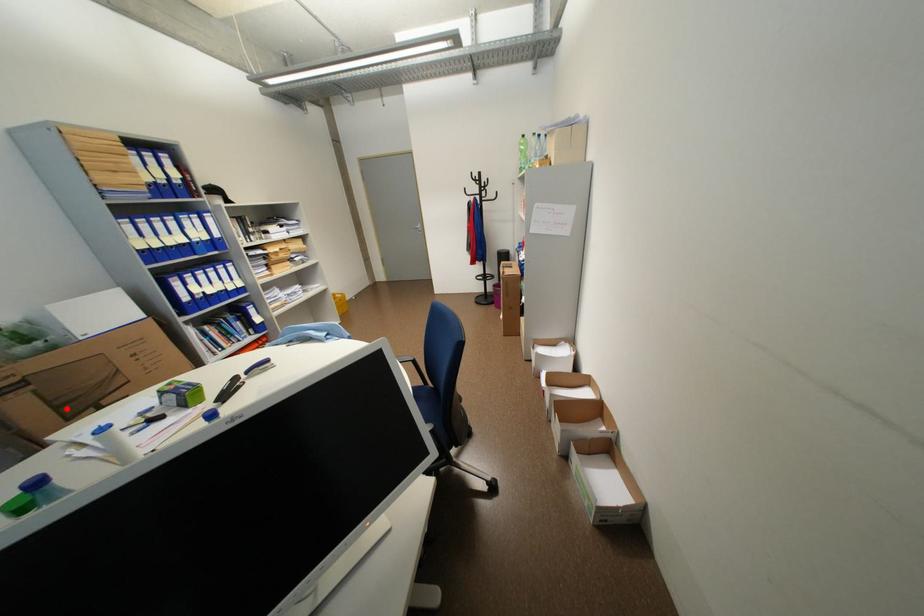
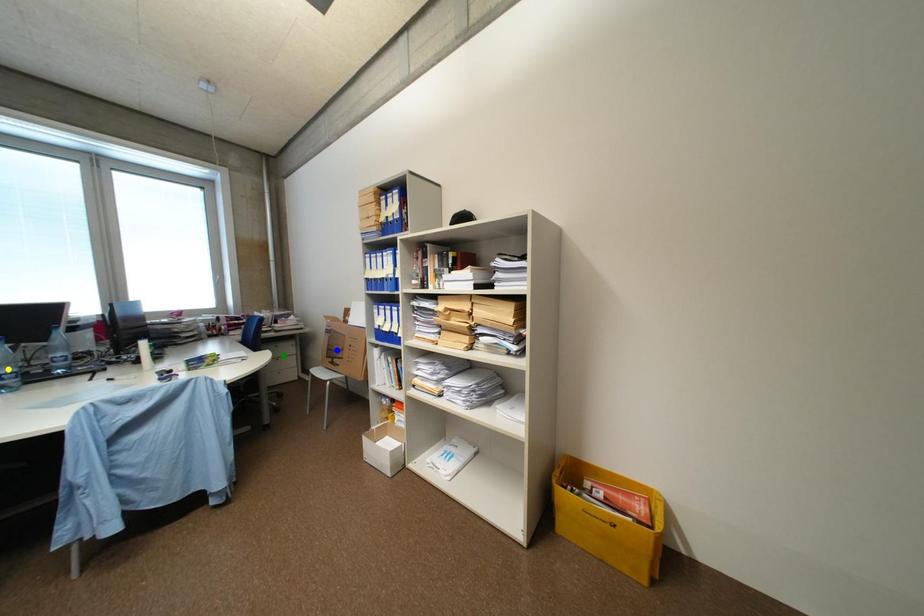
Question: I am providing you with two images of the same scene from different viewpoints. A red point is marked on the first image. You are given multiple points on the second image. Which point in image 2 represents the same 3d spot as the red point in image 1?

Choices:
 (A) yellow point
 (B) blue point
 (C) green point

Answer: (B)